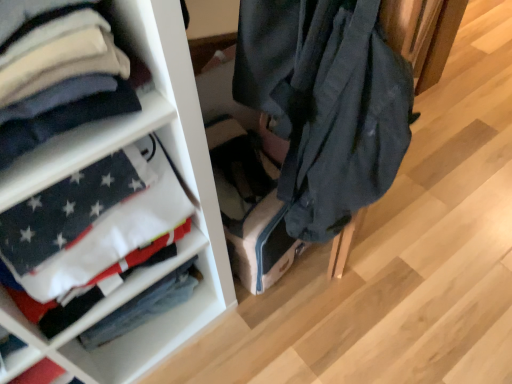
Question: From a real-world perspective, is white fabric at left beneath white cotton shirt at left?

Choices:
 (A) yes
 (B) no

Answer: (A)

Question: Is white cotton shirt at left a part of white fabric at left?

Choices:
 (A) no
 (B) yes

Answer: (A)

Question: Is white fabric at left taller than white cotton shirt at left?

Choices:
 (A) yes
 (B) no

Answer: (A)

Question: Is white fabric at left at the left side of white cotton shirt at left?

Choices:
 (A) yes
 (B) no

Answer: (B)

Question: Considering the relative positions of white fabric at left and white cotton shirt at left in the image provided, is white fabric at left to the right of white cotton shirt at left from the viewer's perspective?

Choices:
 (A) no
 (B) yes

Answer: (B)

Question: Looking at their shapes, would you say white cotton flag at left is wider or thinner than white fabric at left?

Choices:
 (A) wide
 (B) thin

Answer: (B)

Question: Is point (124, 317) positioned closer to the camera than point (187, 157)?

Choices:
 (A) closer
 (B) farther

Answer: (B)

Question: From the image's perspective, is white cotton flag at left above or below white fabric at left?

Choices:
 (A) above
 (B) below

Answer: (B)

Question: Looking at the image, does white cotton flag at left seem bigger or smaller compared to white fabric at left?

Choices:
 (A) big
 (B) small

Answer: (B)

Question: From the image's perspective, relative to white cotton flag at left, is white cotton shirt at left above or below?

Choices:
 (A) above
 (B) below

Answer: (A)

Question: Based on their sizes in the image, would you say white cotton shirt at left is bigger or smaller than white cotton flag at left?

Choices:
 (A) big
 (B) small

Answer: (A)

Question: Considering the relative positions of white cotton shirt at left and white cotton flag at left in the image provided, is white cotton shirt at left to the left or to the right of white cotton flag at left?

Choices:
 (A) right
 (B) left

Answer: (B)

Question: Do you think white cotton shirt at left is within white cotton flag at left, or outside of it?

Choices:
 (A) inside
 (B) outside

Answer: (B)

Question: From the image's perspective, is white fabric at left above or below white cotton flag at left?

Choices:
 (A) below
 (B) above

Answer: (B)

Question: From a real-world perspective, is white fabric at left physically located above or below white cotton flag at left?

Choices:
 (A) above
 (B) below

Answer: (A)